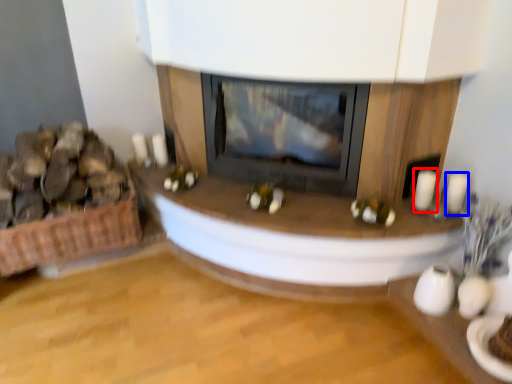
Question: Among these objects, which one is nearest to the camera, candle (highlighted by a red box) or candle (highlighted by a blue box)?

Choices:
 (A) candle
 (B) candle

Answer: (B)